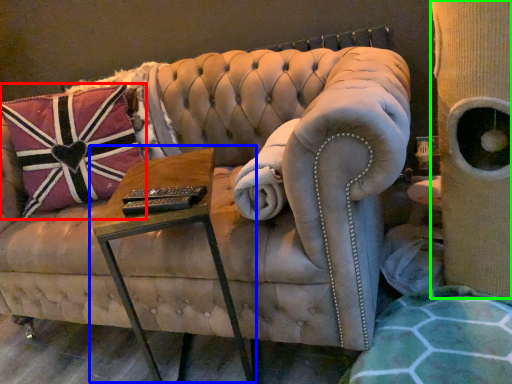
Question: Which object is the closest to the pillow (highlighted by a red box)? Choose among these: table (highlighted by a blue box) or side (highlighted by a green box).

Choices:
 (A) table
 (B) side

Answer: (A)